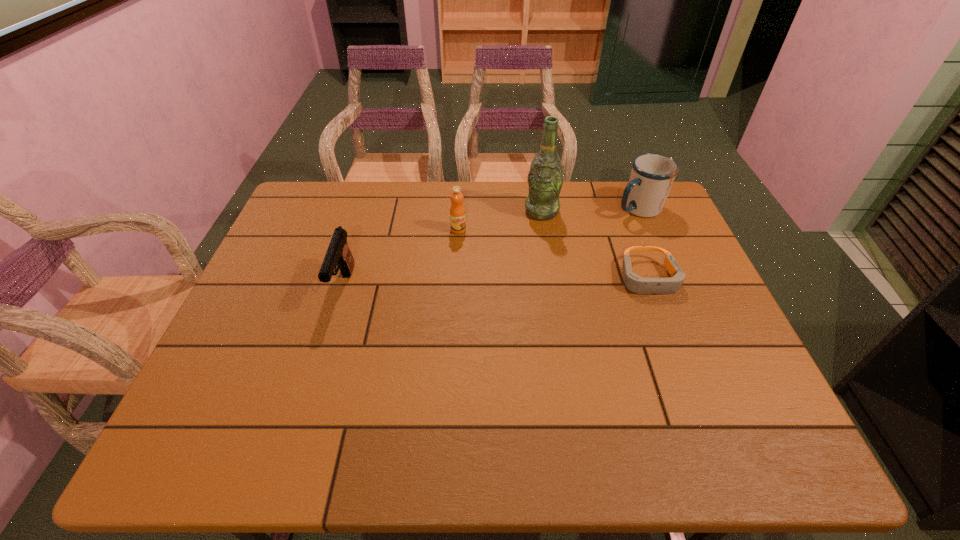
In order to click on pistol in this screenshot , I will do pos(338,254).

This screenshot has height=540, width=960. I want to click on goggles, so click(633, 282).

Where is `the third object from left to right`? the third object from left to right is located at coordinates (545, 179).

What are the coordinates of `beer bottle` in the screenshot? It's located at (545, 179).

Identify the location of mug. Image resolution: width=960 pixels, height=540 pixels. (652, 175).

Locate an element on the screen. The width and height of the screenshot is (960, 540). orange juice is located at coordinates (457, 211).

This screenshot has height=540, width=960. I want to click on the third farthest object, so click(x=457, y=211).

I want to click on free region located 0.130m at the barrel of the leftmost object, so click(x=323, y=357).

You are a GUI agent. You are given a task and a screenshot of the screen. Output one action in this format:
    pyautogui.click(x=<x>, y=<y>)
    Task: Click on the vacant region located on the front and back of the goggles
    
    Given the screenshot: What is the action you would take?
    pyautogui.click(x=676, y=350)

Where is `vacant space located 0.090m on the surface of the tallest object`? vacant space located 0.090m on the surface of the tallest object is located at coordinates (531, 239).